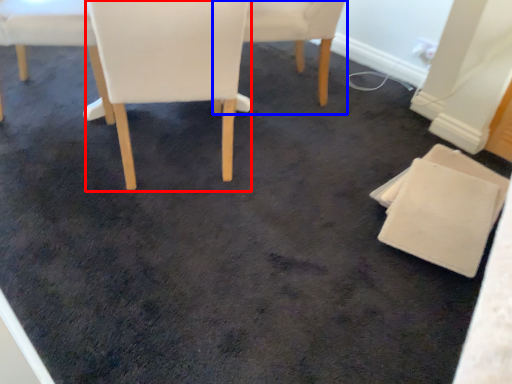
Question: Which of the following is the closest to the observer, chair (highlighted by a red box) or chair (highlighted by a blue box)?

Choices:
 (A) chair
 (B) chair

Answer: (A)